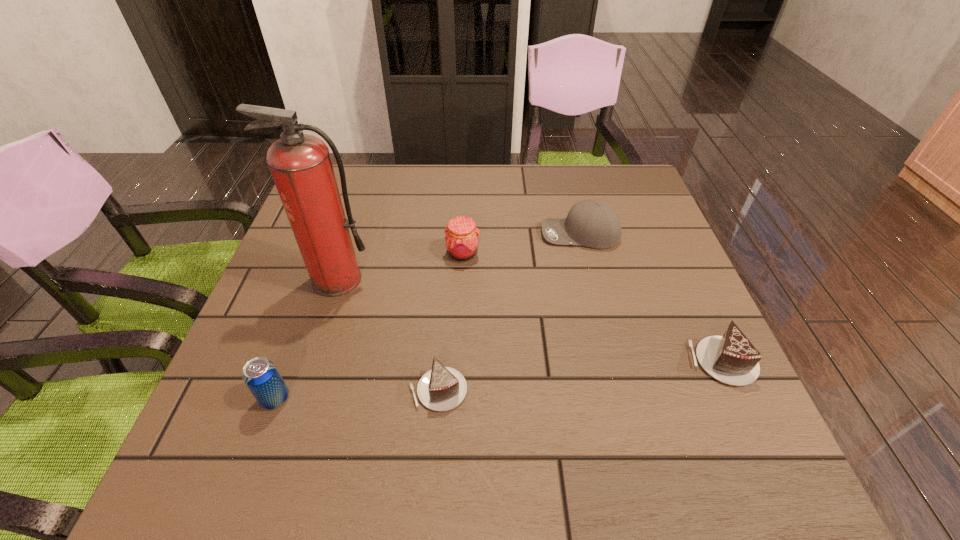
Where is `free space located 0.230m on the front brim of the fifth object from left to right`? The height and width of the screenshot is (540, 960). free space located 0.230m on the front brim of the fifth object from left to right is located at coordinates (451, 234).

You are a GUI agent. You are given a task and a screenshot of the screen. Output one action in this format:
    pyautogui.click(x=<x>, y=<y>)
    Task: Click on the blank area located 0.080m on the front brim of the fifth object from left to right
    
    Given the screenshot: What is the action you would take?
    pyautogui.click(x=510, y=234)

Image resolution: width=960 pixels, height=540 pixels. I want to click on vacant region located on the front brim of the fifth object from left to right, so 435,234.

The width and height of the screenshot is (960, 540). I want to click on free spot located 0.280m at the nozzle of the tallest object, so click(295, 414).

The image size is (960, 540). What are the coordinates of `free point located 0.110m on the right of the jam` in the screenshot? It's located at (525, 253).

The image size is (960, 540). In order to click on vacant space located on the back of the beer can in this screenshot , I will do `click(300, 330)`.

Locate an element on the screen. The width and height of the screenshot is (960, 540). beer can situated at the near edge is located at coordinates (261, 376).

At what (x,y) coordinates should I click in order to perform the action: click on fire extinguisher located at the left edge. Please return your answer as a coordinate pair (x, y). Looking at the image, I should click on (300, 164).

Identify the location of beer can at the left edge. The width and height of the screenshot is (960, 540). (261, 376).

Find the location of a particular element. The height and width of the screenshot is (540, 960). chocolate cake present at the right edge is located at coordinates (732, 359).